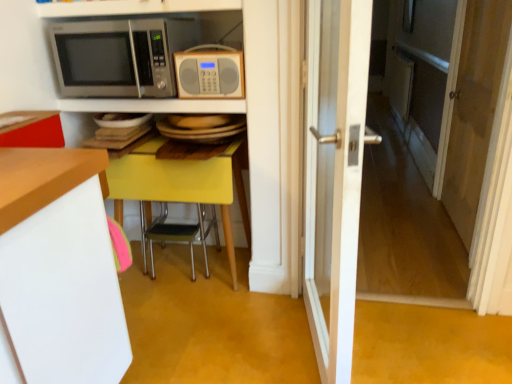
Question: Could you tell me if satin silver microwave at upper left, which ranks as the second microwave oven in right-to-left order, is turned towards yellow glossy table at center?

Choices:
 (A) no
 (B) yes

Answer: (A)

Question: Does satin silver microwave at upper left, which ranks as the second microwave oven in right-to-left order, have a lesser width compared to yellow glossy table at center?

Choices:
 (A) no
 (B) yes

Answer: (B)

Question: Considering the relative positions of satin silver microwave at upper left, the first microwave oven when ordered from left to right, and yellow glossy table at center in the image provided, is satin silver microwave at upper left, the first microwave oven when ordered from left to right, to the left of yellow glossy table at center from the viewer's perspective?

Choices:
 (A) yes
 (B) no

Answer: (A)

Question: Considering the relative sizes of satin silver microwave at upper left, which ranks as the second microwave oven in right-to-left order, and yellow glossy table at center in the image provided, is satin silver microwave at upper left, which ranks as the second microwave oven in right-to-left order, shorter than yellow glossy table at center?

Choices:
 (A) no
 (B) yes

Answer: (B)

Question: Is satin silver microwave at upper left, which ranks as the second microwave oven in right-to-left order, positioned beyond the bounds of yellow glossy table at center?

Choices:
 (A) no
 (B) yes

Answer: (B)

Question: From the image's perspective, is satin silver microwave at upper left, the first microwave oven when ordered from left to right, above or below white glossy shelf at upper center, acting as the 2th shelf starting from the bottom?

Choices:
 (A) above
 (B) below

Answer: (B)

Question: Would you say satin silver microwave at upper left, which ranks as the second microwave oven in right-to-left order, is to the left or to the right of white glossy shelf at upper center, which is the 1th shelf in top-to-bottom order, in the picture?

Choices:
 (A) right
 (B) left

Answer: (B)

Question: Considering the positions of satin silver microwave at upper left, the first microwave oven when ordered from left to right, and white glossy shelf at upper center, acting as the 2th shelf starting from the bottom, in the image, is satin silver microwave at upper left, the first microwave oven when ordered from left to right, taller or shorter than white glossy shelf at upper center, acting as the 2th shelf starting from the bottom,?

Choices:
 (A) tall
 (B) short

Answer: (A)

Question: From a real-world perspective, relative to white glossy shelf at upper center, acting as the 2th shelf starting from the bottom, is satin silver microwave at upper left, the first microwave oven when ordered from left to right, vertically above or below?

Choices:
 (A) above
 (B) below

Answer: (B)

Question: From a real-world perspective, is white glossy shelf at upper center, acting as the 2th shelf starting from the bottom, above or below satin silver microwave at upper left, the first microwave oven when ordered from left to right?

Choices:
 (A) below
 (B) above

Answer: (B)

Question: Relative to satin silver microwave at upper left, which ranks as the second microwave oven in right-to-left order, is white glossy shelf at upper center, acting as the 2th shelf starting from the bottom, in front or behind?

Choices:
 (A) front
 (B) behind

Answer: (A)

Question: Based on their sizes in the image, would you say white glossy shelf at upper center, which is the 1th shelf in top-to-bottom order, is bigger or smaller than satin silver microwave at upper left, the first microwave oven when ordered from left to right?

Choices:
 (A) small
 (B) big

Answer: (A)

Question: Visually, is white glossy shelf at upper center, acting as the 2th shelf starting from the bottom, positioned to the left or to the right of satin silver microwave at upper left, which ranks as the second microwave oven in right-to-left order?

Choices:
 (A) left
 (B) right

Answer: (B)

Question: From a real-world perspective, relative to white wooden door at center, is metallic silver microwave at upper center, positioned as the 1th shelf in bottom-to-top order, vertically above or below?

Choices:
 (A) below
 (B) above

Answer: (B)

Question: Is metallic silver microwave at upper center, which is the second shelf from top to bottom, to the left or to the right of white wooden door at center in the image?

Choices:
 (A) right
 (B) left

Answer: (B)